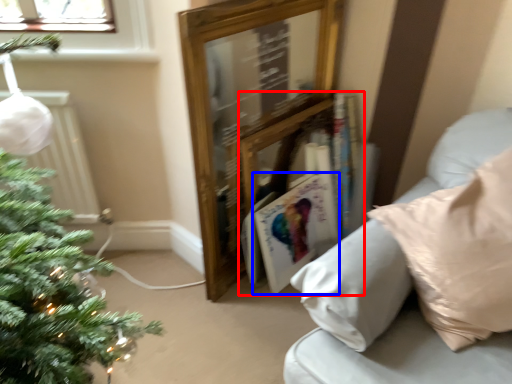
Question: Which point is closer to the camera, book (highlighted by a red box) or magazine (highlighted by a blue box)?

Choices:
 (A) book
 (B) magazine

Answer: (A)